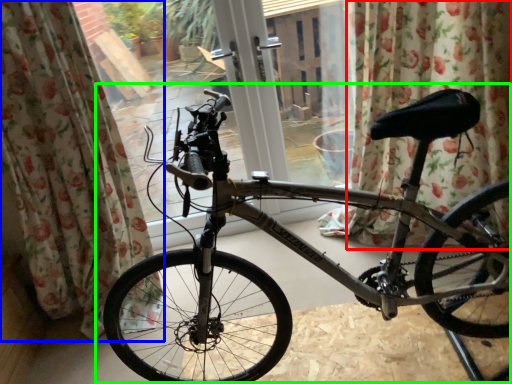
Question: Which object is the farthest from curtain (highlighted by a red box)? Choose among these: curtain (highlighted by a blue box) or bicycle (highlighted by a green box).

Choices:
 (A) curtain
 (B) bicycle

Answer: (A)